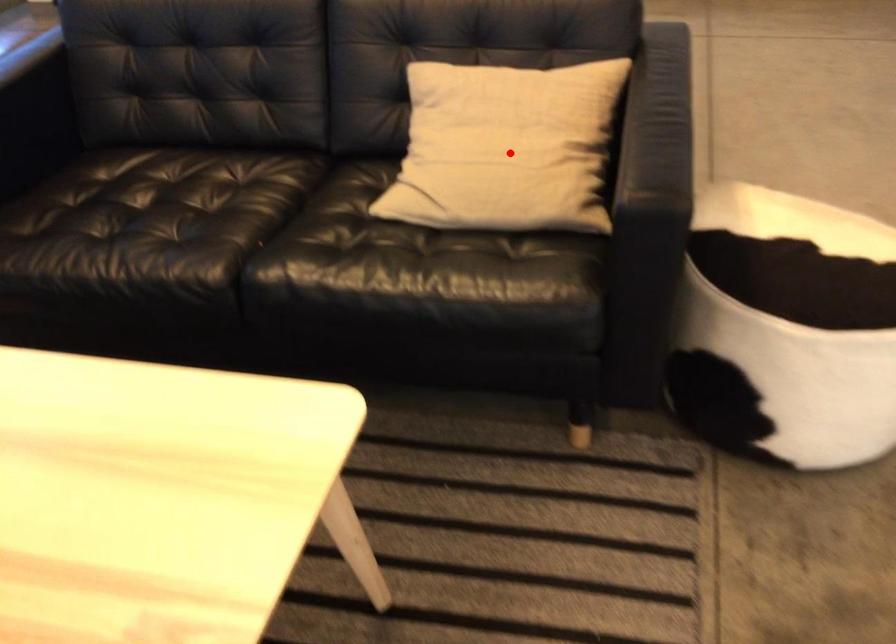
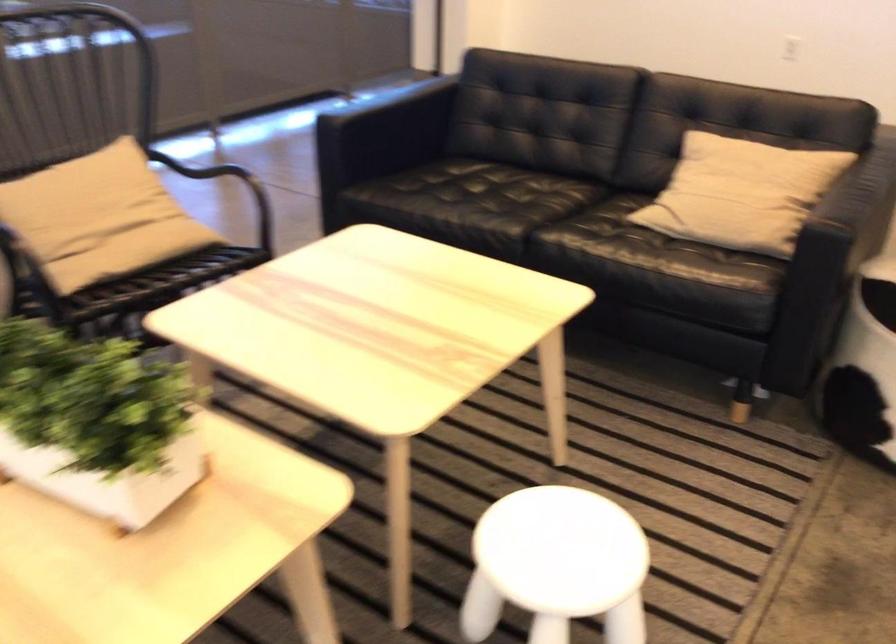
In the second image, find the point that corresponds to the highlighted location in the first image.

(741, 193)